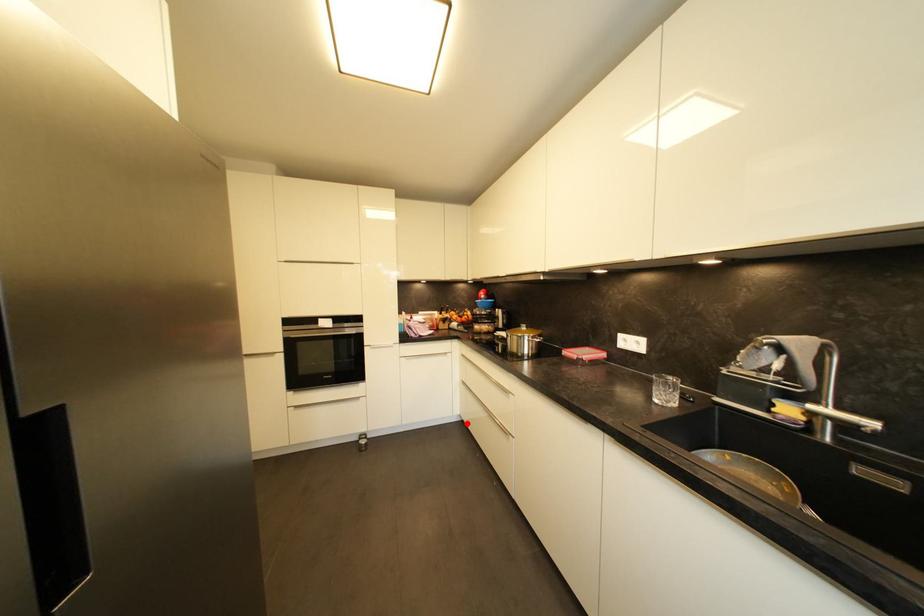
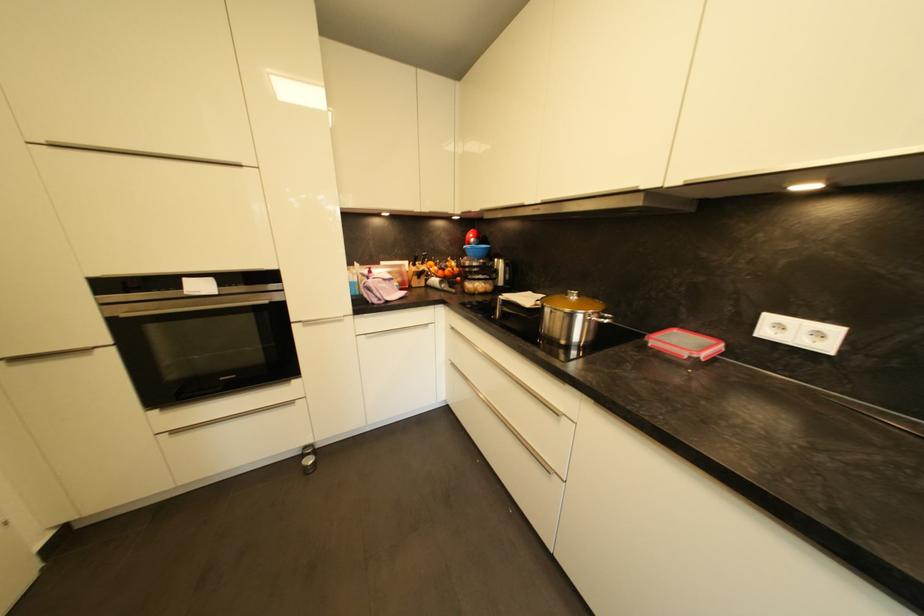
Question: I am providing you with two images of the same scene from different viewpoints. A red point is marked on the first image. Can you still see the location of the red point in image 2?

Choices:
 (A) Yes
 (B) No

Answer: (A)